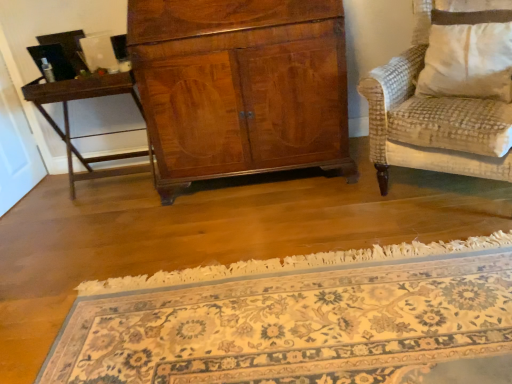
Where is `vacant space positioned to the left of dark brown wood table at left`? The height and width of the screenshot is (384, 512). vacant space positioned to the left of dark brown wood table at left is located at coordinates (32, 210).